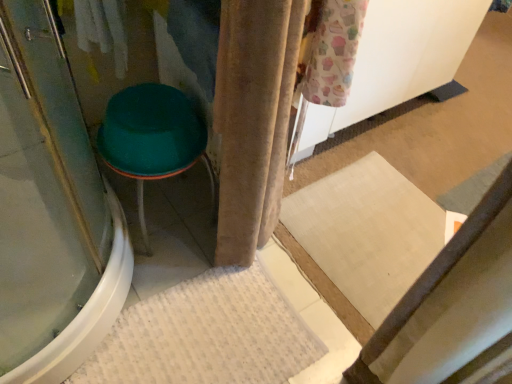
Identify the location of green plastic stool at left. (153, 139).

This screenshot has height=384, width=512. What are the coordinates of `transparent glass screen door at left` in the screenshot? It's located at (51, 210).

Locate an element on the screen. beige velvet curtain at center is located at coordinates (253, 119).

Which of these two, green plastic stool at left or white textured bath mat at lower center, is thinner?

green plastic stool at left is thinner.

Can you confirm if green plastic stool at left is smaller than white textured bath mat at lower center?

Actually, green plastic stool at left might be larger than white textured bath mat at lower center.

In terms of height, does green plastic stool at left look taller or shorter compared to white textured bath mat at lower center?

Clearly, green plastic stool at left is taller compared to white textured bath mat at lower center.

Is green plastic stool at left turned away from white textured bath mat at lower center?

green plastic stool at left is not turned away from white textured bath mat at lower center.

Is beige velvet curtain at center facing towards green plastic stool at left?

No, beige velvet curtain at center is not turned towards green plastic stool at left.

From the image's perspective, which is below, beige velvet curtain at center or green plastic stool at left?

green plastic stool at left is shown below in the image.

Is beige velvet curtain at center taller than green plastic stool at left?

Yes.

Can you confirm if beige velvet curtain at center is positioned to the left of green plastic stool at left?

In fact, beige velvet curtain at center is to the right of green plastic stool at left.

Can you see transparent glass screen door at left touching white textured bath mat at lower center?

No, transparent glass screen door at left is not making contact with white textured bath mat at lower center.

At what (x,y) coordinates should I click in order to perform the action: click on screen door lying above the white textured bath mat at lower center (from the image's perspective). Please return your answer as a coordinate pair (x, y). Image resolution: width=512 pixels, height=384 pixels. Looking at the image, I should click on (51, 210).

Is transparent glass screen door at left to the left of white textured bath mat at lower center from the viewer's perspective?

Yes, transparent glass screen door at left is to the left of white textured bath mat at lower center.

From the image's perspective, is transparent glass screen door at left on white textured bath mat at lower center?

Indeed, from the image's perspective, transparent glass screen door at left is shown above white textured bath mat at lower center.

From a real-world perspective, is white textured bath mat at lower center located beneath transparent glass screen door at left?

Yes, from a real-world perspective, white textured bath mat at lower center is under transparent glass screen door at left.

Can you tell me how much white textured bath mat at lower center and transparent glass screen door at left differ in facing direction?

87.4 degrees.

From the image's perspective, which is below, white textured bath mat at lower center or transparent glass screen door at left?

white textured bath mat at lower center appears lower in the image.

Is beige velvet curtain at center in contact with white textured bath mat at lower center?

No, beige velvet curtain at center is not touching white textured bath mat at lower center.

Between beige velvet curtain at center and white textured bath mat at lower center, which one has less height?

With less height is white textured bath mat at lower center.

Between beige velvet curtain at center and white textured bath mat at lower center, which one is positioned behind?

Positioned behind is white textured bath mat at lower center.

Could you tell me if green plastic stool at left is turned towards beige velvet curtain at center?

No, green plastic stool at left is not turned towards beige velvet curtain at center.

Is green plastic stool at left positioned far away from beige velvet curtain at center?

No, green plastic stool at left is in close proximity to beige velvet curtain at center.

Between green plastic stool at left and beige velvet curtain at center, which one has larger size?

green plastic stool at left is bigger.

Who is shorter, transparent glass screen door at left or beige velvet curtain at center?

beige velvet curtain at center is shorter.

Based on the photo, from the image's perspective, would you say transparent glass screen door at left is positioned over beige velvet curtain at center?

Yes.

The width and height of the screenshot is (512, 384). Find the location of `screen door that is above the beige velvet curtain at center (from a real-world perspective)`. screen door that is above the beige velvet curtain at center (from a real-world perspective) is located at coordinates (51, 210).

Looking at their sizes, would you say transparent glass screen door at left is wider or thinner than beige velvet curtain at center?

Considering their sizes, transparent glass screen door at left looks broader than beige velvet curtain at center.

There is a white textured bath mat at lower center. Where is `furniture above it (from a real-world perspective)`? furniture above it (from a real-world perspective) is located at coordinates (153, 139).

In order to click on furniture on the left of beige velvet curtain at center in this screenshot , I will do `click(153, 139)`.

Based on their spatial positions, is transparent glass screen door at left or green plastic stool at left closer to white textured bath mat at lower center?

transparent glass screen door at left lies closer to white textured bath mat at lower center than the other object.

Estimate the real-world distances between objects in this image. Which object is closer to beige velvet curtain at center, white textured bath mat at lower center or green plastic stool at left?

green plastic stool at left.

From the image, which object appears to be farther from green plastic stool at left, white textured bath mat at lower center or beige velvet curtain at center?

Among the two, white textured bath mat at lower center is located further to green plastic stool at left.

When comparing their distances from white textured bath mat at lower center, does beige velvet curtain at center or transparent glass screen door at left seem further?

The object further to white textured bath mat at lower center is beige velvet curtain at center.

Based on their spatial positions, is white textured bath mat at lower center or beige velvet curtain at center further from transparent glass screen door at left?

beige velvet curtain at center is further to transparent glass screen door at left.

Based on their spatial positions, is green plastic stool at left or beige velvet curtain at center closer to white textured bath mat at lower center?

Based on the image, beige velvet curtain at center appears to be nearer to white textured bath mat at lower center.

When comparing their distances from green plastic stool at left, does beige velvet curtain at center or transparent glass screen door at left seem further?

Among the two, transparent glass screen door at left is located further to green plastic stool at left.

When comparing their distances from white textured bath mat at lower center, does green plastic stool at left or transparent glass screen door at left seem closer?

transparent glass screen door at left lies closer to white textured bath mat at lower center than the other object.

Find the location of a particular element. This screenshot has height=384, width=512. curtain located between transparent glass screen door at left and green plastic stool at left in the depth direction is located at coordinates (253, 119).

What are the coordinates of `bath mat between transparent glass screen door at left and green plastic stool at left from front to back` in the screenshot? It's located at (206, 335).

Image resolution: width=512 pixels, height=384 pixels. In order to click on curtain between transparent glass screen door at left and white textured bath mat at lower center from front to back in this screenshot , I will do `click(253, 119)`.

I want to click on furniture between beige velvet curtain at center and white textured bath mat at lower center in the up-down direction, so click(153, 139).